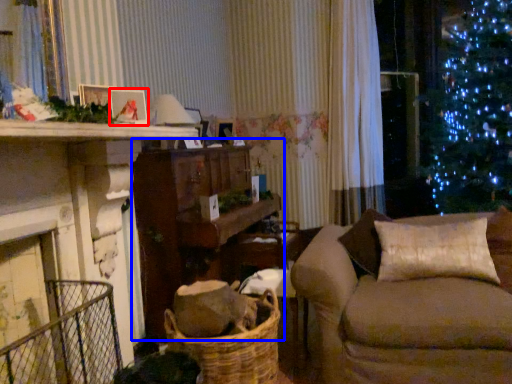
Question: Among these objects, which one is nearest to the camera, picture frame (highlighted by a red box) or table (highlighted by a blue box)?

Choices:
 (A) picture frame
 (B) table

Answer: (A)